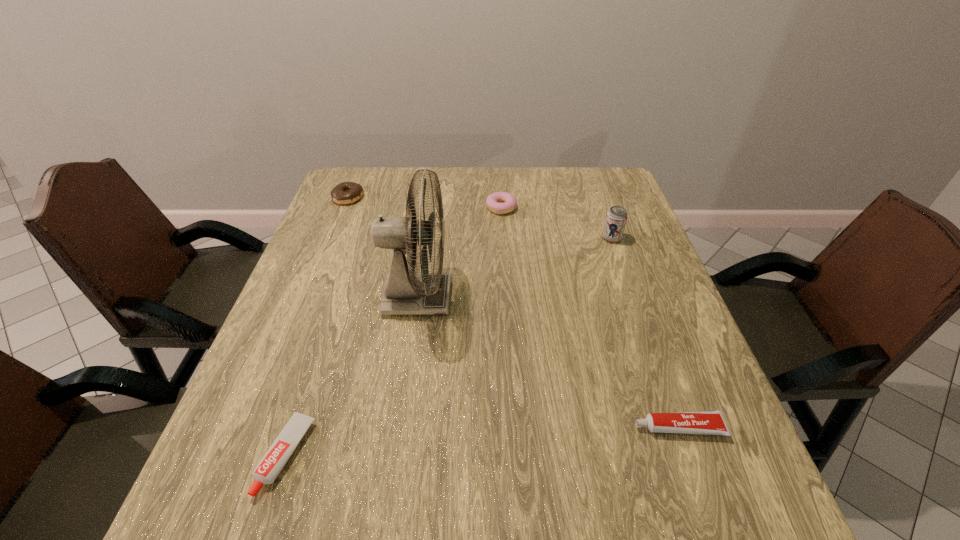
This screenshot has width=960, height=540. What are the coordinates of `free spot between the right toothpaste and the third nearest object` in the screenshot? It's located at (548, 362).

I want to click on vacant area that lies between the beer can and the third object from right to left, so click(x=556, y=223).

You are a GUI agent. You are given a task and a screenshot of the screen. Output one action in this format:
    pyautogui.click(x=<x>, y=<y>)
    Task: Click on the free point between the third object from right to left and the third farthest object
    
    Given the screenshot: What is the action you would take?
    pyautogui.click(x=556, y=223)

Where is `free spot between the right toothpaste and the right doughnut`? The height and width of the screenshot is (540, 960). free spot between the right toothpaste and the right doughnut is located at coordinates (589, 318).

At what (x,y) coordinates should I click in order to perform the action: click on blank region between the fourth farthest object and the beer can. Please return your answer as a coordinate pair (x, y). The width and height of the screenshot is (960, 540). Looking at the image, I should click on (515, 268).

Identify which object is the fourth closest to the right toothpaste. Please provide its 2D coordinates. Your answer should be formatted as a tuple, i.e. [(x, y)], where the tuple contains the x and y coordinates of a point satisfying the conditions above.

[(500, 202)]

Locate which object ranks fourth in proximity to the right toothpaste. Please provide its 2D coordinates. Your answer should be formatted as a tuple, i.e. [(x, y)], where the tuple contains the x and y coordinates of a point satisfying the conditions above.

[(500, 202)]

Locate an element on the screen. free location that satisfies the following two spatial constraints: 1. on the front side of the left doughnut; 2. on the left side of the second tallest object is located at coordinates (331, 238).